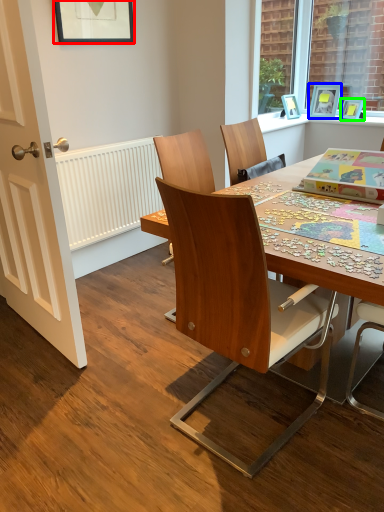
Question: Considering the real-world distances, which object is farthest from picture frame (highlighted by a red box)? picture frame (highlighted by a blue box) or picture frame (highlighted by a green box)?

Choices:
 (A) picture frame
 (B) picture frame

Answer: (B)